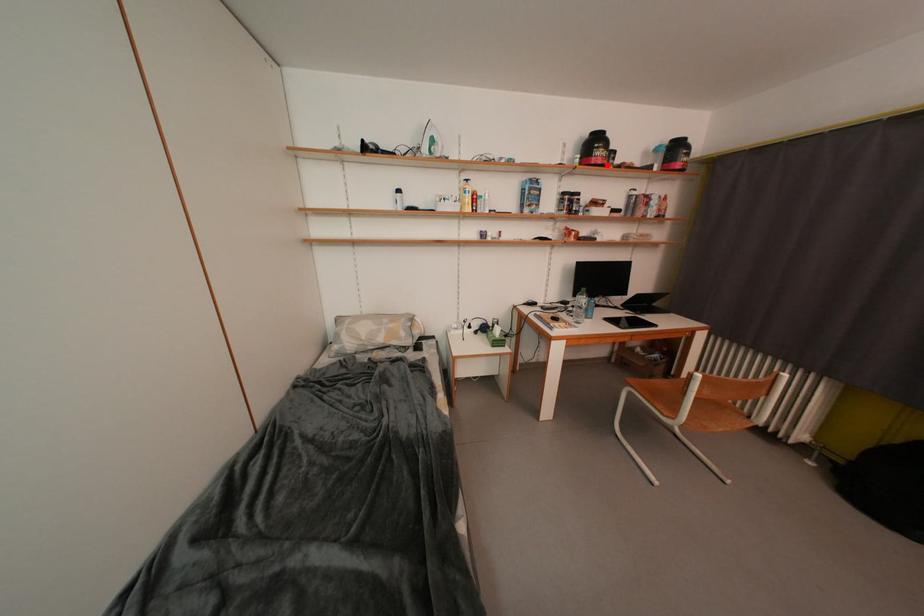
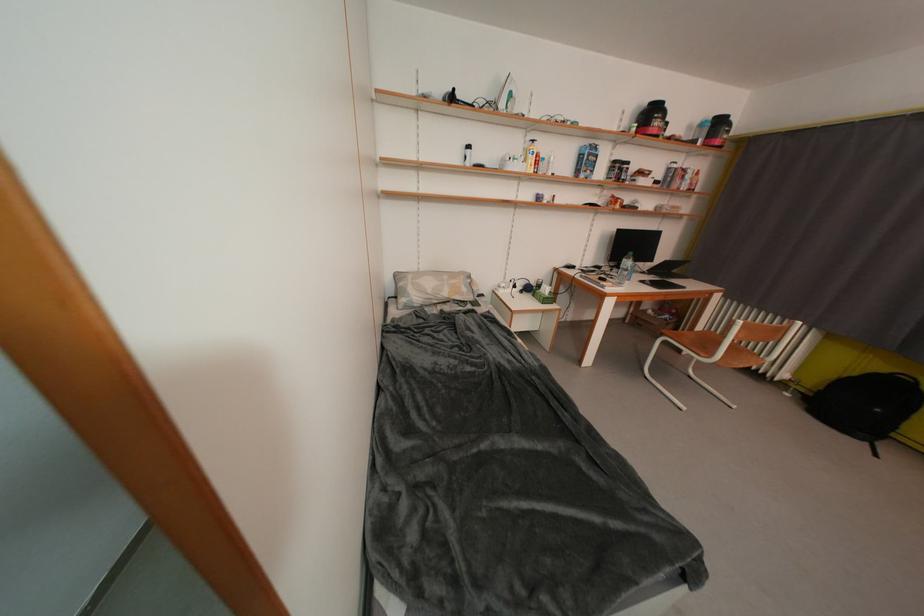
Find the pixel in the second image that matches the highlighted location in the first image.

(663, 136)